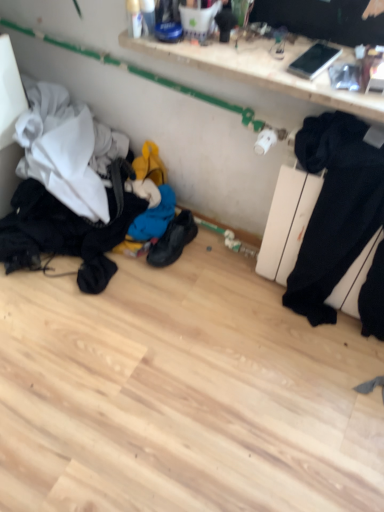
Question: Does black leather shoes at center appear on the left side of black fabric laundry at lower left?

Choices:
 (A) no
 (B) yes

Answer: (A)

Question: From a real-world perspective, is black leather shoes at center positioned over black fabric laundry at lower left based on gravity?

Choices:
 (A) no
 (B) yes

Answer: (A)

Question: Considering the relative sizes of black leather shoes at center and black fabric laundry at lower left in the image provided, is black leather shoes at center taller than black fabric laundry at lower left?

Choices:
 (A) no
 (B) yes

Answer: (A)

Question: Considering the relative positions of black leather shoes at center and black fabric laundry at lower left in the image provided, is black leather shoes at center behind black fabric laundry at lower left?

Choices:
 (A) yes
 (B) no

Answer: (A)

Question: Considering the relative sizes of black leather shoes at center and black fabric laundry at lower left in the image provided, is black leather shoes at center thinner than black fabric laundry at lower left?

Choices:
 (A) no
 (B) yes

Answer: (B)

Question: Considering the positions of white glossy shelf at upper center and black leather shoes at center in the image, is white glossy shelf at upper center bigger or smaller than black leather shoes at center?

Choices:
 (A) small
 (B) big

Answer: (B)

Question: In the image, is white glossy shelf at upper center on the left side or the right side of black leather shoes at center?

Choices:
 (A) right
 (B) left

Answer: (A)

Question: Is point (215, 60) closer or farther from the camera than point (177, 223)?

Choices:
 (A) farther
 (B) closer

Answer: (B)

Question: From a real-world perspective, is white glossy shelf at upper center above or below black leather shoes at center?

Choices:
 (A) above
 (B) below

Answer: (A)

Question: Is black fabric laundry at lower left inside or outside of black leather shoes at center?

Choices:
 (A) inside
 (B) outside

Answer: (B)

Question: Considering their positions, is black fabric laundry at lower left located in front of or behind black leather shoes at center?

Choices:
 (A) behind
 (B) front

Answer: (B)

Question: Looking at their shapes, would you say black fabric laundry at lower left is wider or thinner than black leather shoes at center?

Choices:
 (A) thin
 (B) wide

Answer: (B)

Question: In terms of height, does black fabric laundry at lower left look taller or shorter compared to black leather shoes at center?

Choices:
 (A) short
 (B) tall

Answer: (B)

Question: Is white glossy shelf at upper center inside the boundaries of black fabric laundry at lower left, or outside?

Choices:
 (A) inside
 (B) outside

Answer: (B)

Question: In the image, is white glossy shelf at upper center positioned in front of or behind black fabric laundry at lower left?

Choices:
 (A) front
 (B) behind

Answer: (A)